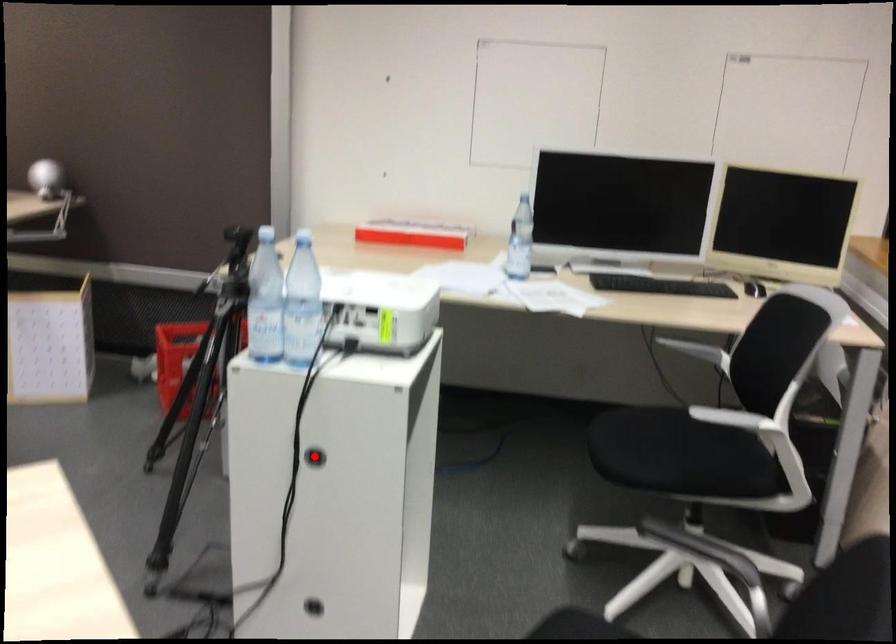
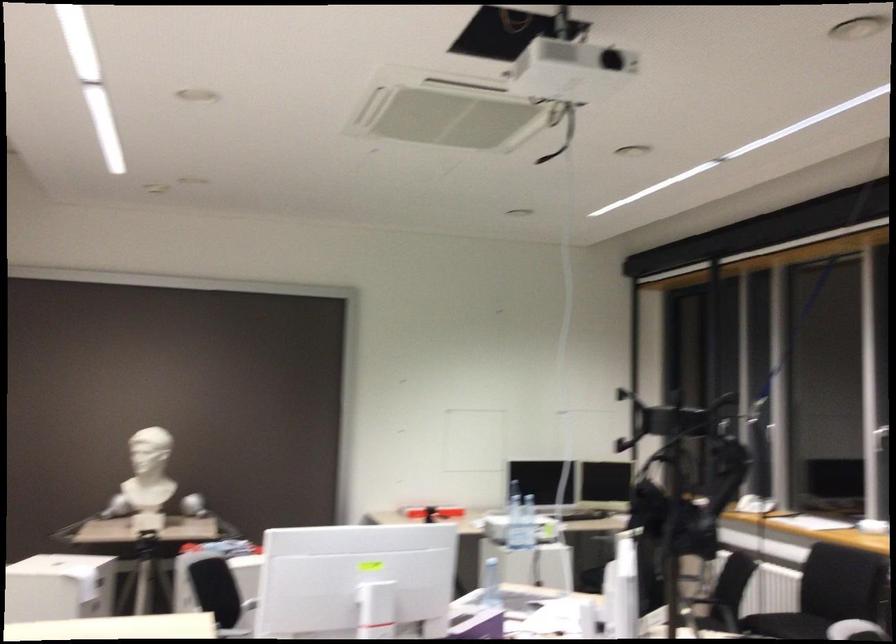
Question: I am providing you with two images of the same scene from different viewpoints. A red point is marked on the first image. Can you still see the location of the red point in image 2?

Choices:
 (A) Yes
 (B) No

Answer: (B)